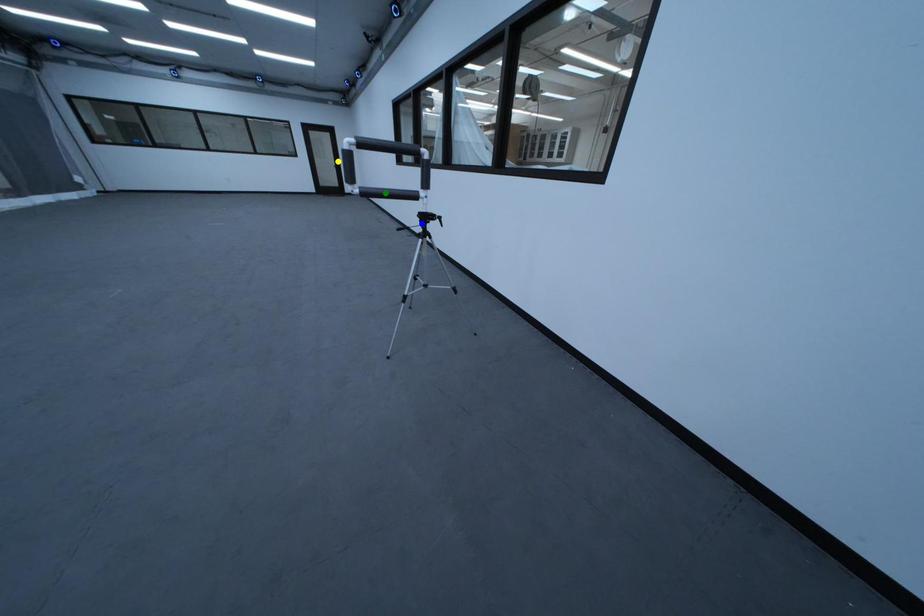
Order these from nearest to farthest:
green point | yellow point | blue point

yellow point
blue point
green point